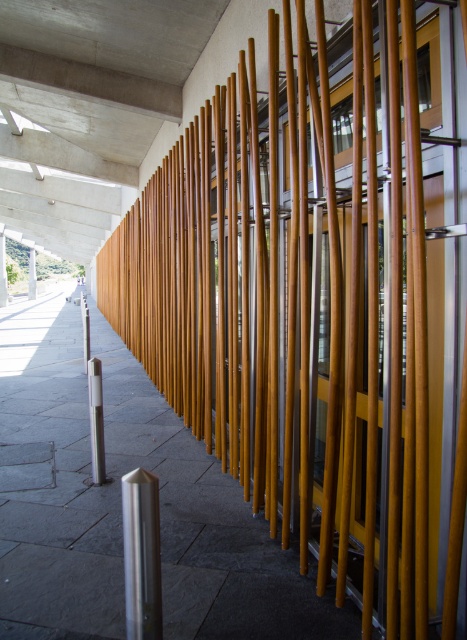
Question: Which point is closer to the camera?

Choices:
 (A) slate gray pavement at center
 (B) smooth concrete pillar at center

Answer: (A)

Question: Is slate gray pavement at center wider than smooth concrete pillar at center?

Choices:
 (A) yes
 (B) no

Answer: (A)

Question: Does slate gray pavement at center have a greater width compared to smooth concrete pillar at center?

Choices:
 (A) no
 (B) yes

Answer: (B)

Question: Which of the following is the closest to the observer?

Choices:
 (A) (33, 298)
 (B) (59, 531)

Answer: (B)

Question: Considering the relative positions of slate gray pavement at center and smooth concrete pillar at center in the image provided, where is slate gray pavement at center located with respect to smooth concrete pillar at center?

Choices:
 (A) right
 (B) left

Answer: (A)